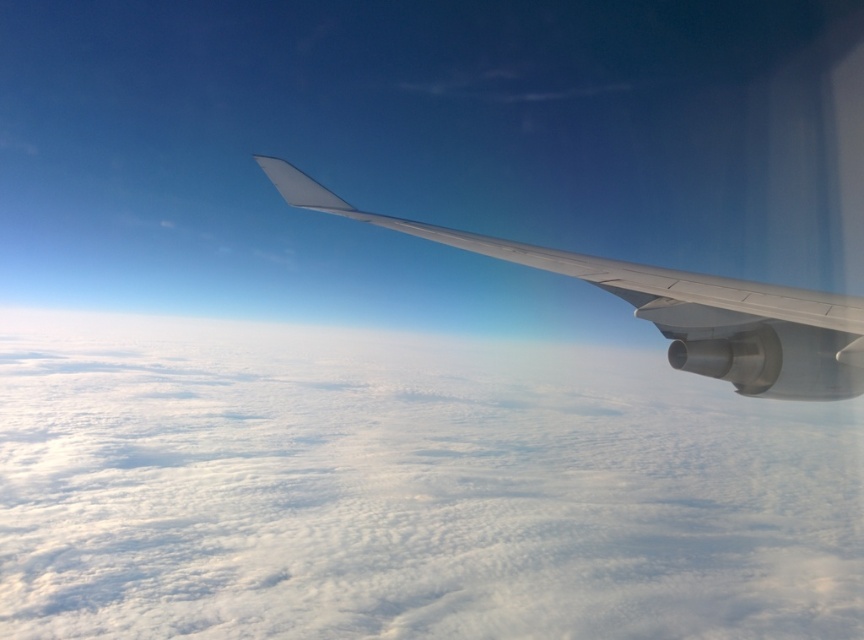
You are a pilot observing the clouds and the wing from the cockpit. Which object, the white fluffy cloud at upper center or the white matte wing at upper right, would appear bigger in your view?

The white fluffy cloud at upper center appears bigger than the white matte wing at upper right because it has a larger size according to the description.

You are a pilot looking at the clouds and the wing from the cockpit. Which object, the white fluffy cloud at upper center or the white matte wing at upper right, has a greater width?

The white fluffy cloud at upper center has a greater width than the white matte wing at upper right according to the description.

You are a pilot looking at the clouds outside the aircraft window. You notice the white fluffy cloud at upper center. Can you estimate its 2D coordinates in the image?

The 2D coordinates of the white fluffy cloud at upper center are at point (x=407, y=488).